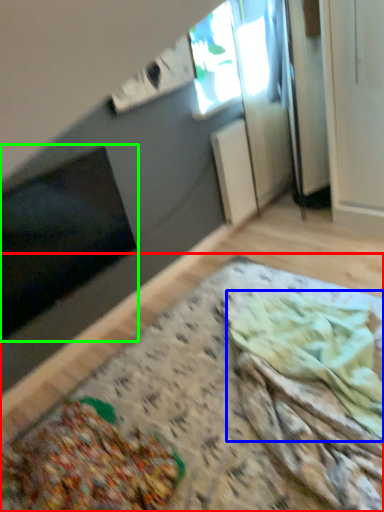
Question: Considering the real-world distances, which object is closest to table (highlighted by a red box)? food (highlighted by a blue box) or window screen (highlighted by a green box).

Choices:
 (A) food
 (B) window screen

Answer: (A)